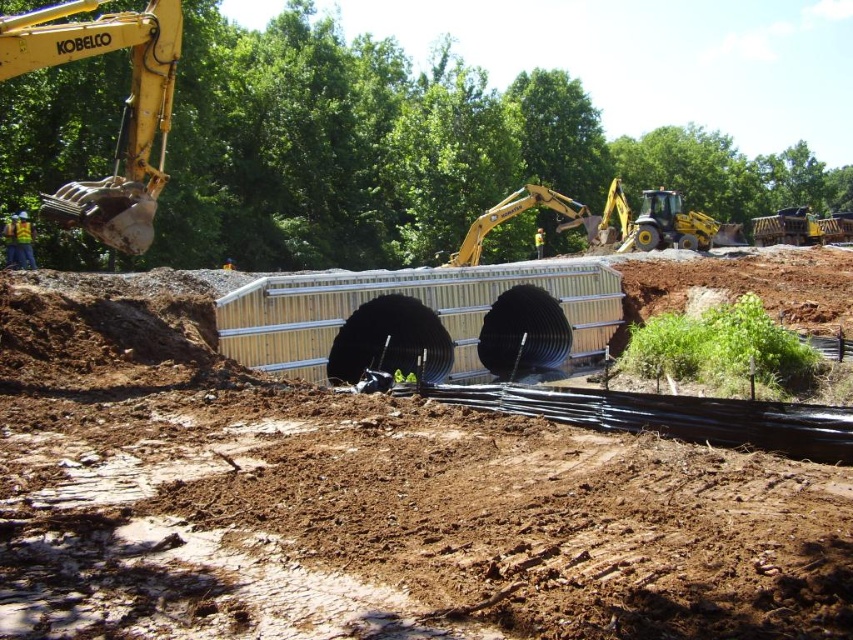
Is black corrugated pipe at center further to camera compared to yellow metallic excavator at upper left?

No, black corrugated pipe at center is in front of yellow metallic excavator at upper left.

What do you see at coordinates (363, 499) in the screenshot?
I see `black corrugated pipe at center` at bounding box center [363, 499].

The width and height of the screenshot is (853, 640). I want to click on black corrugated pipe at center, so tap(363, 499).